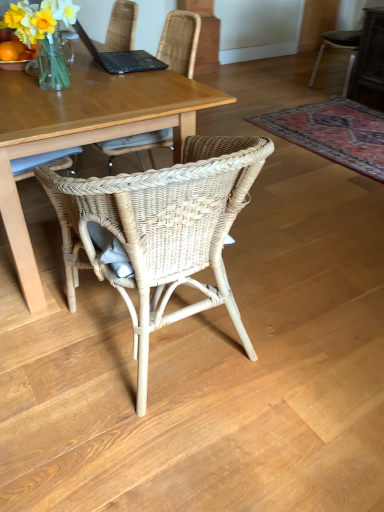
Find the location of `vacant area that is in front of translucent glass vase at upper left`. vacant area that is in front of translucent glass vase at upper left is located at coordinates (52, 104).